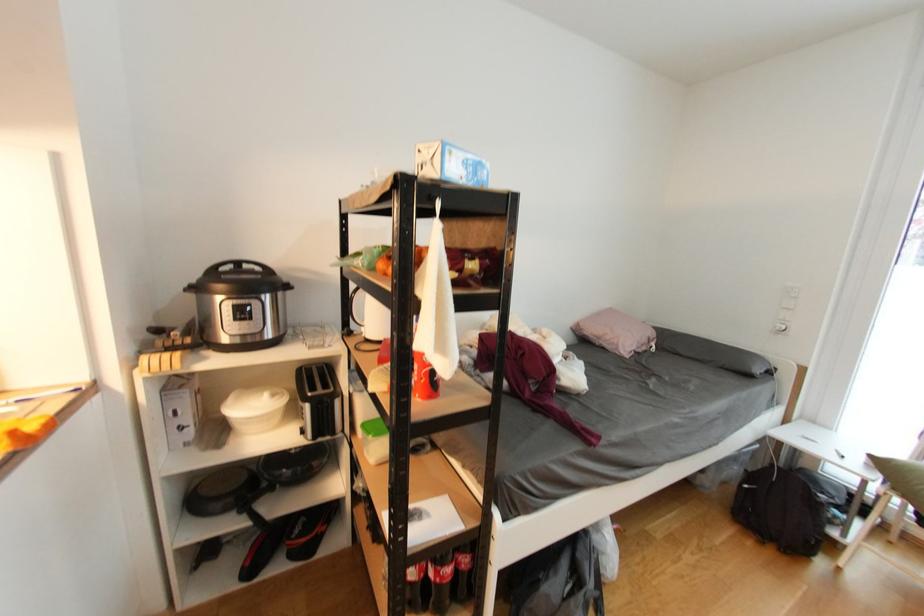
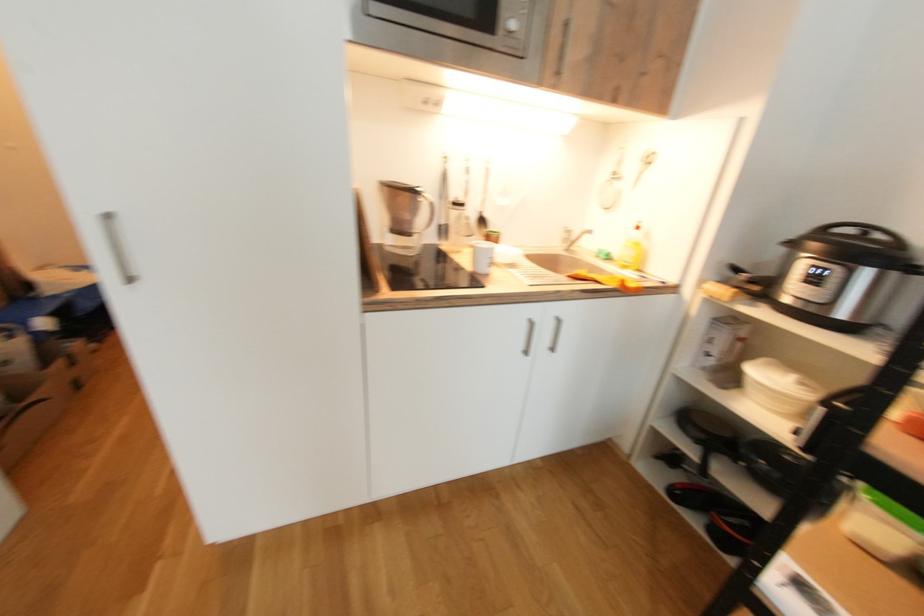
How did the camera likely rotate?

The rotation direction of the camera is left-down.